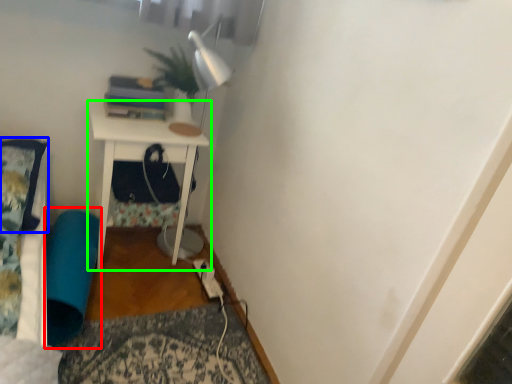
Question: Which is nearer to the bean bag chair (highlighted by a red box)? pillow (highlighted by a blue box) or nightstand (highlighted by a green box).

Choices:
 (A) pillow
 (B) nightstand

Answer: (B)